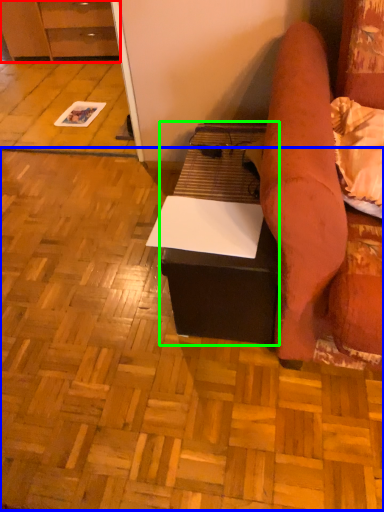
Question: Which object is the closest to the cabinetry (highlighted by a red box)? Choose among these: plywood (highlighted by a blue box) or table (highlighted by a green box).

Choices:
 (A) plywood
 (B) table

Answer: (A)